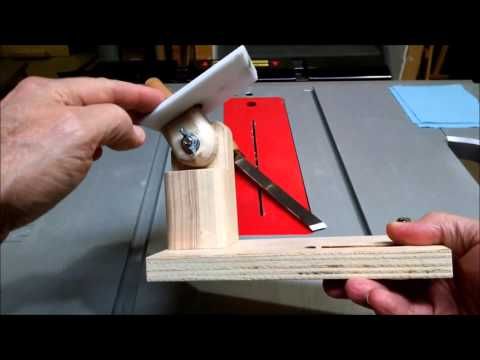
In order to click on shelf in this screenshot , I will do `click(410, 74)`, `click(202, 49)`.